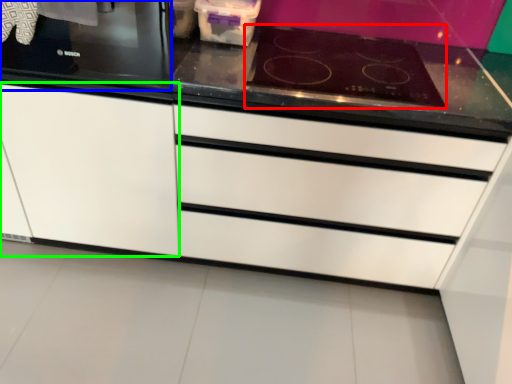
Question: Based on their relative distances, which object is farther from gas stove (highlighted by a red box)? Choose from home appliance (highlighted by a blue box) and cabinetry (highlighted by a green box).

Choices:
 (A) home appliance
 (B) cabinetry

Answer: (B)